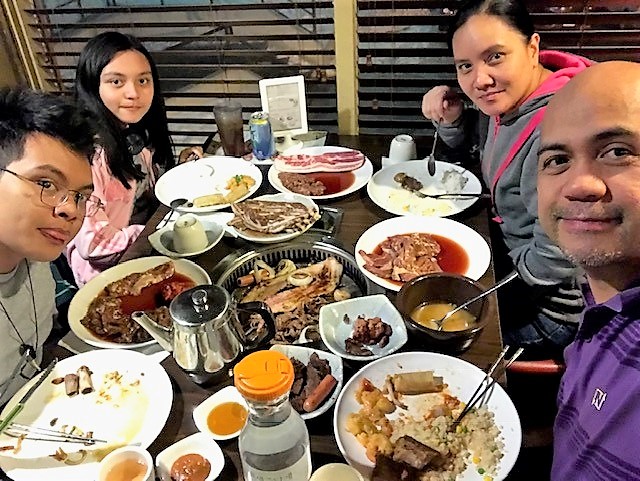
Where is `spoons`? The width and height of the screenshot is (640, 481). spoons is located at coordinates (436, 321), (177, 201), (429, 162).